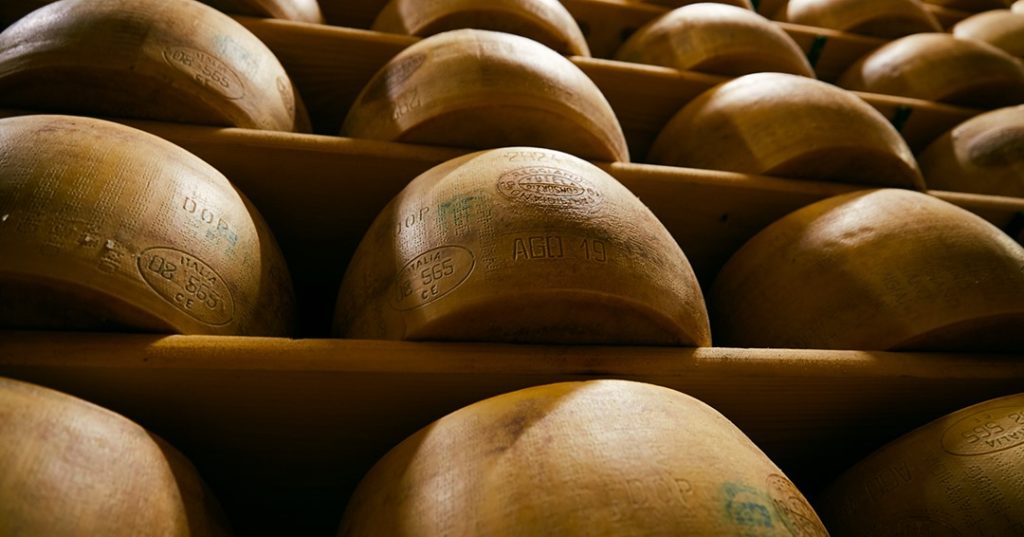
Find the location of a particular element. The height and width of the screenshot is (537, 1024). pots is located at coordinates (94, 175), (137, 25), (469, 78), (606, 447), (906, 264), (783, 112).